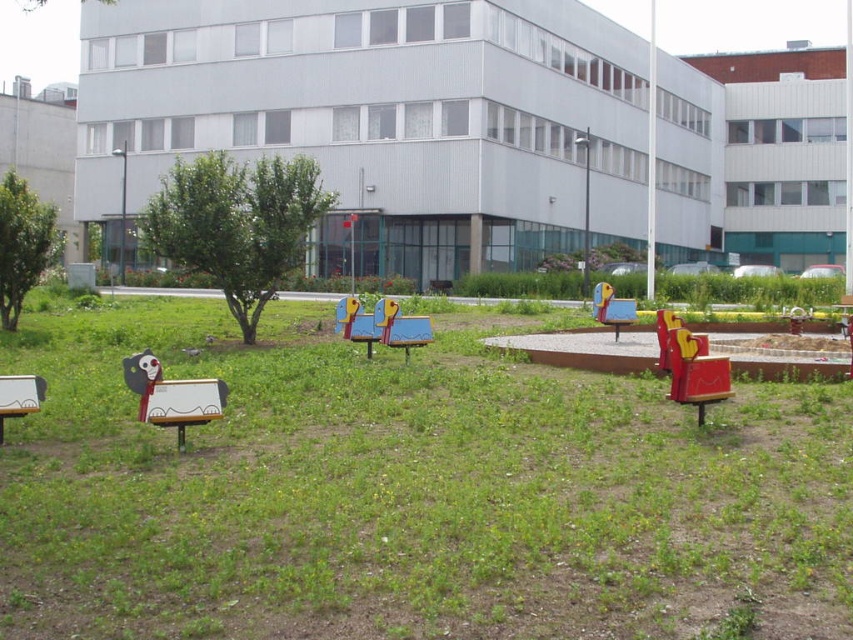
You are a child trying to find a bench to sit on. You see the wooden painted bench at lower left and the wooden painted bench at center. Which bench is closer to the left side of the image?

The wooden painted bench at lower left is closer to the left side of the image because it is positioned to the left of the wooden painted bench at center.

You are a parent trying to decide where to sit your child for a better view of the playground. The wooden painted bench at lower left and the wooden painted bench at center are both available. Which bench provides a wider seating area?

The wooden painted bench at center has a greater width compared to the wooden painted bench at lower left, so it provides a wider seating area.

You are standing at the point closest to the large modern building. Which point, point (x=148, y=422) or point (x=403, y=339), is closer to you?

Point (x=403, y=339) is closer to you because it is behind point (x=148, y=422), so you are standing near the building and point (x=403, y=339) is between you and point (x=148, y=422).